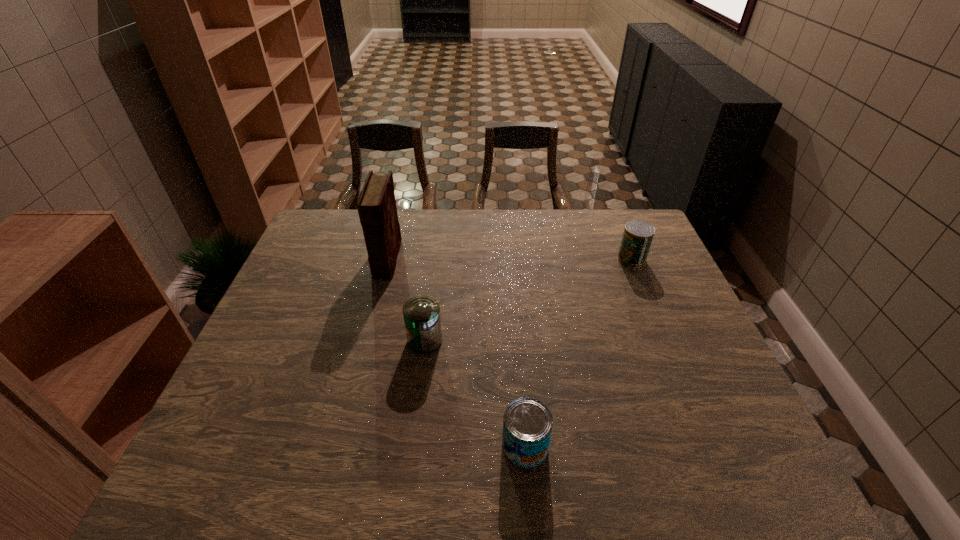
This screenshot has height=540, width=960. Identify the location of the leftmost object. (376, 205).

I want to click on hardback book, so [376, 205].

You are a GUI agent. You are given a task and a screenshot of the screen. Output one action in this format:
    pyautogui.click(x=<x>, y=<y>)
    Task: Click on the third farthest object
    This screenshot has width=960, height=540.
    Given the screenshot: What is the action you would take?
    pyautogui.click(x=422, y=319)

Locate an element on the screen. This screenshot has width=960, height=540. the leftmost can is located at coordinates (422, 319).

Identify the location of the rightmost can. Image resolution: width=960 pixels, height=540 pixels. (637, 237).

Find the location of a particular element. the farthest can is located at coordinates (637, 237).

What are the coordinates of `the third object from left to right` in the screenshot? It's located at click(x=527, y=423).

You are a GUI agent. You are given a task and a screenshot of the screen. Output one action in this format:
    pyautogui.click(x=<x>, y=<y>)
    Task: Click on the second can from right to left
    The width and height of the screenshot is (960, 540).
    Given the screenshot: What is the action you would take?
    point(527,423)

Find the location of a particular element. The image size is (960, 540). vacant space located on the spine side of the hardback book is located at coordinates (372, 313).

This screenshot has height=540, width=960. I want to click on free space located 0.110m on the back of the leftmost can, so click(430, 299).